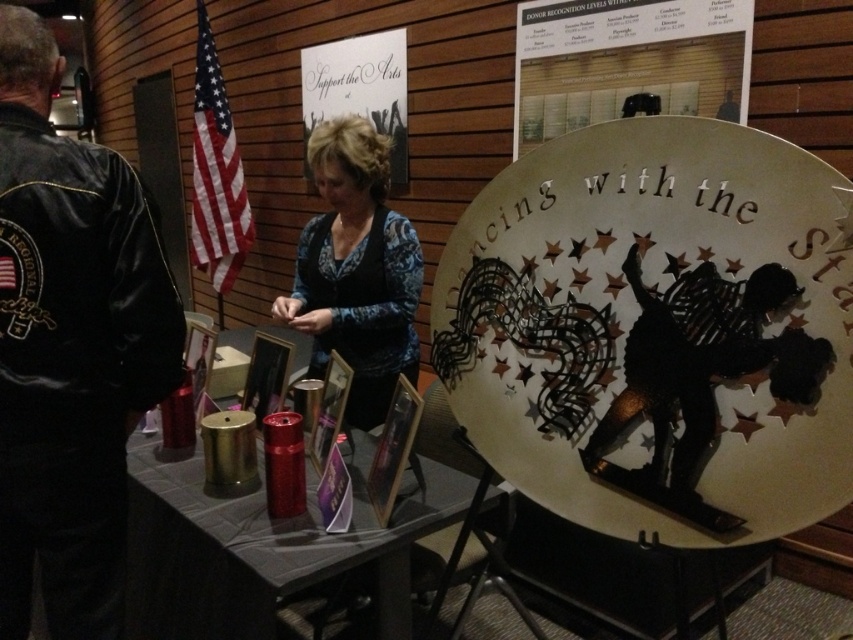
Question: Based on their relative distances, which object is nearer to the black leather jacket at left?

Choices:
 (A) metallic red thermos at lower center
 (B) blue patterned sweater at center

Answer: (A)

Question: Does metallic red thermos at lower center appear under blue patterned sweater at center?

Choices:
 (A) yes
 (B) no

Answer: (A)

Question: Which point is closer to the camera taking this photo?

Choices:
 (A) (426, 500)
 (B) (329, 230)
 (C) (13, 589)

Answer: (C)

Question: Where is black leather jacket at left located in relation to blue patterned sweater at center in the image?

Choices:
 (A) below
 (B) above

Answer: (A)

Question: Considering the real-world distances, which object is closest to the metallic red thermos at lower center?

Choices:
 (A) blue patterned sweater at center
 (B) black leather jacket at left

Answer: (B)

Question: Is the position of black leather jacket at left less distant than that of blue patterned sweater at center?

Choices:
 (A) no
 (B) yes

Answer: (B)